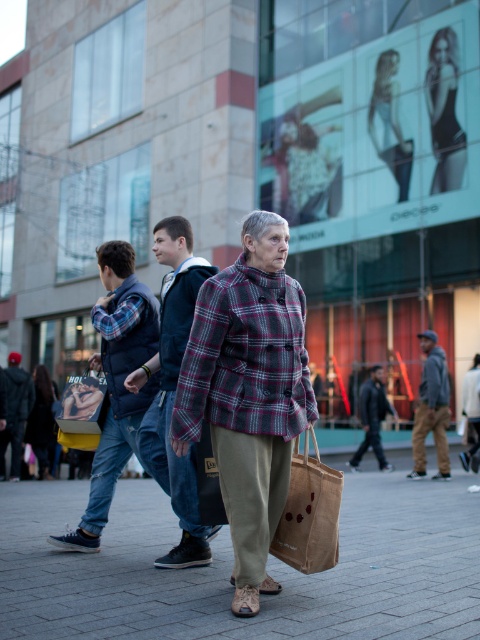
Can you confirm if plaid fabric at center is positioned above dark gray jacket at center?

Yes.

Can you confirm if plaid fabric at center is shorter than dark gray jacket at center?

In fact, plaid fabric at center may be taller than dark gray jacket at center.

This screenshot has height=640, width=480. What do you see at coordinates (249, 394) in the screenshot?
I see `plaid fabric at center` at bounding box center [249, 394].

I want to click on plaid fabric at center, so click(x=249, y=394).

Based on the photo, can you confirm if denim jeans at left is bigger than brown jute bag at lower center?

Yes, denim jeans at left is bigger than brown jute bag at lower center.

From the picture: Which of these two, denim jeans at left or brown jute bag at lower center, stands taller?

denim jeans at left is taller.

Is point (147, 291) less distant than point (322, 477)?

No, it is not.

At what (x,y) coordinates should I click in order to perform the action: click on denim jeans at left. Please return your answer as a coordinate pair (x, y). This screenshot has width=480, height=640. Looking at the image, I should click on (117, 381).

Is brown jute bag at lower center to the right of gray hoodie at right from the viewer's perspective?

In fact, brown jute bag at lower center is to the left of gray hoodie at right.

Which is behind, point (302, 499) or point (436, 381)?

Point (436, 381)

Which is in front, point (300, 557) or point (420, 413)?

Positioned in front is point (300, 557).

The width and height of the screenshot is (480, 640). In order to click on brown jute bag at lower center in this screenshot , I will do `click(310, 513)`.